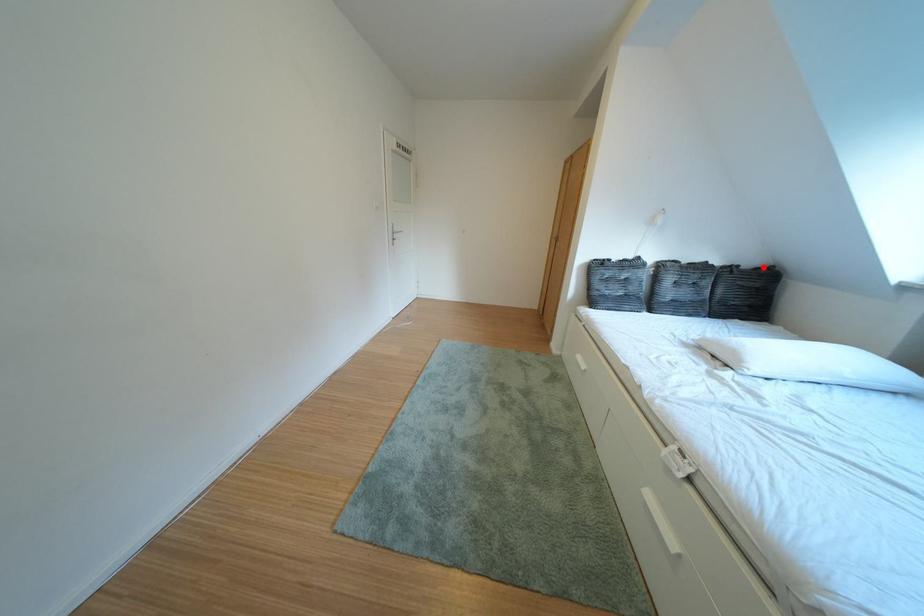
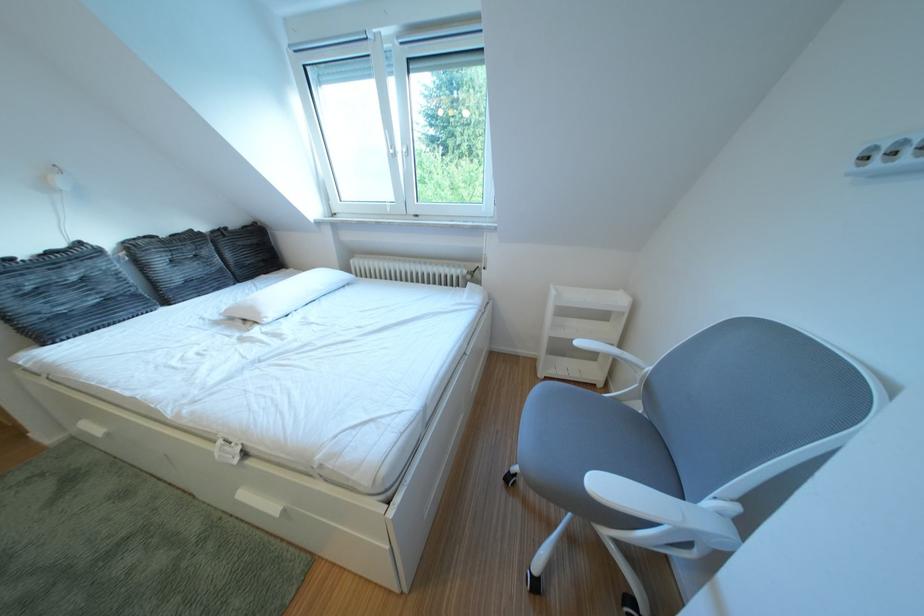
Question: I am providing you with two images of the same scene from different viewpoints. In image1, a red point is highlighted. Considering the same 3D point in image2, which of the following is correct?

Choices:
 (A) It is closer
 (B) It is farther

Answer: (A)